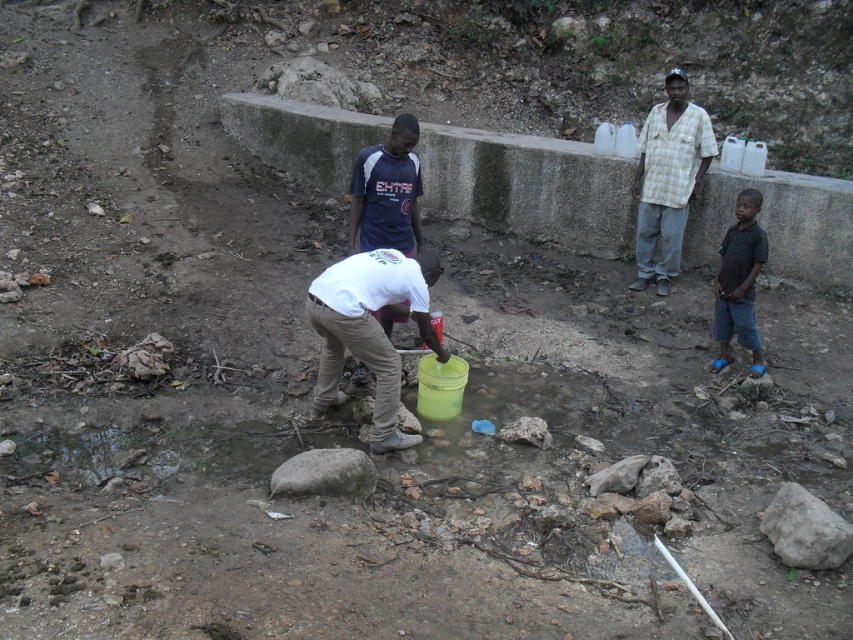
You are a photographer trying to capture the scene from above. You notice two people in the image, one wearing a white matte shirt at center and another in a checkered shirt at upper right. Which person should you focus on to ensure they are in the lower part of your photo?

The white matte shirt at center is below the checkered shirt at upper right, so focusing on the white matte shirt at center will place them in the lower part of the photo.

You are standing at the edge of the stream and need to hand the white cotton shirt at center a tool that is 15 feet long. Can you reach them without moving?

The white cotton shirt at center is 18.18 feet away from the viewer. Since the tool is 15 feet long, you cannot reach them without moving closer.